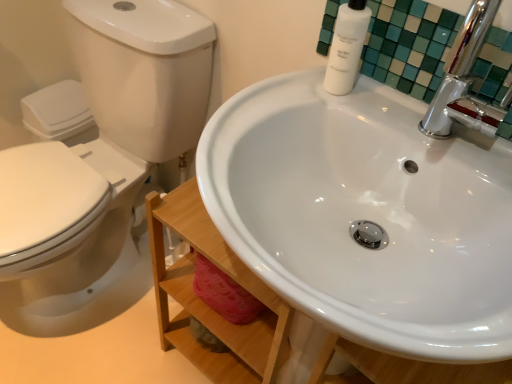
Question: Does white matte bottle at upper right have a smaller size compared to white glossy toilet at left?

Choices:
 (A) yes
 (B) no

Answer: (A)

Question: From a real-world perspective, is white matte bottle at upper right positioned under white glossy toilet at left based on gravity?

Choices:
 (A) yes
 (B) no

Answer: (B)

Question: From the image's perspective, is white matte bottle at upper right on white glossy toilet at left?

Choices:
 (A) yes
 (B) no

Answer: (A)

Question: Is white matte bottle at upper right positioned far away from white glossy toilet at left?

Choices:
 (A) no
 (B) yes

Answer: (A)

Question: Is white matte bottle at upper right thinner than white glossy toilet at left?

Choices:
 (A) no
 (B) yes

Answer: (B)

Question: Does white matte bottle at upper right have a lesser height compared to white glossy toilet at left?

Choices:
 (A) no
 (B) yes

Answer: (B)

Question: From the image's perspective, is white glossy bottle at upper right on top of white glossy sink at center?

Choices:
 (A) no
 (B) yes

Answer: (B)

Question: Does white glossy bottle at upper right have a greater width compared to white glossy sink at center?

Choices:
 (A) yes
 (B) no

Answer: (B)

Question: Is white glossy bottle at upper right facing away from white glossy sink at center?

Choices:
 (A) yes
 (B) no

Answer: (B)

Question: Can you confirm if white glossy bottle at upper right is positioned to the left of white glossy sink at center?

Choices:
 (A) no
 (B) yes

Answer: (A)

Question: From the image's perspective, would you say white glossy bottle at upper right is shown under white glossy sink at center?

Choices:
 (A) yes
 (B) no

Answer: (B)

Question: Is white glossy bottle at upper right closer to the viewer compared to white glossy sink at center?

Choices:
 (A) no
 (B) yes

Answer: (A)

Question: Does white glossy toilet at left lie behind white glossy bottle at upper right?

Choices:
 (A) no
 (B) yes

Answer: (A)